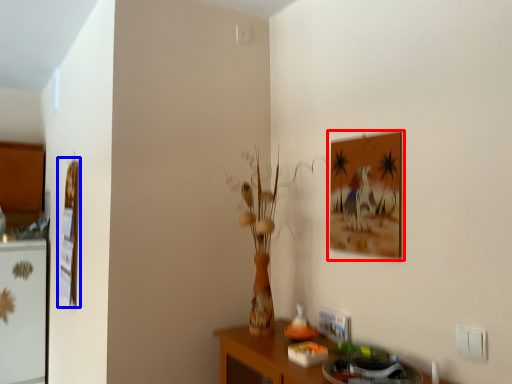
Question: Among these objects, which one is farthest to the camera, picture frame (highlighted by a red box) or picture frame (highlighted by a blue box)?

Choices:
 (A) picture frame
 (B) picture frame

Answer: (B)